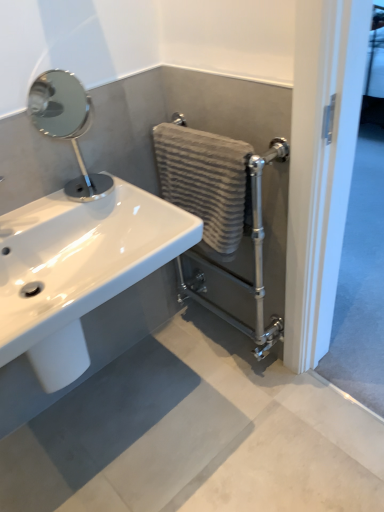
Find the location of `vacant space situated above matte gray concrete at lower center (from a real-world perspective)`. vacant space situated above matte gray concrete at lower center (from a real-world perspective) is located at coordinates (198, 434).